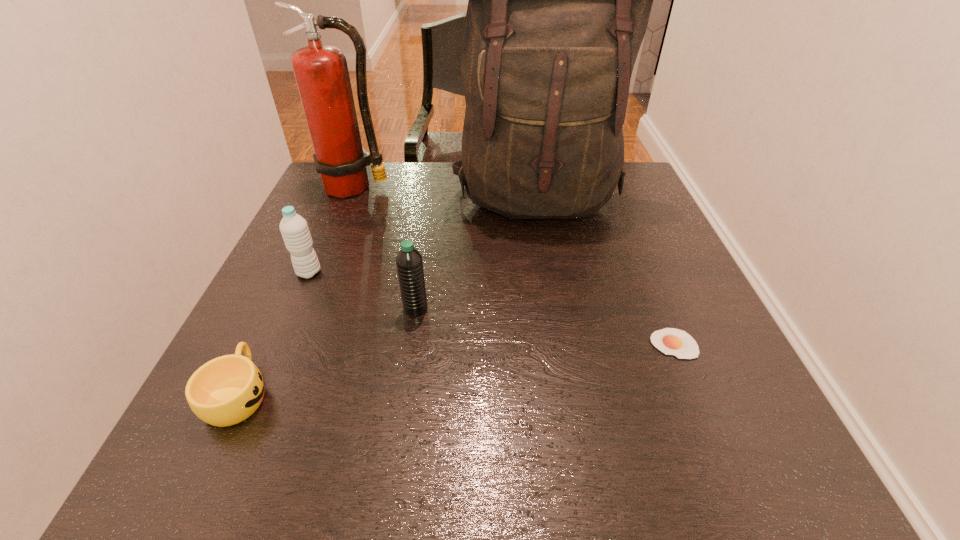
Locate an element on the screen. This screenshot has width=960, height=540. water bottle that is at the left edge is located at coordinates pos(294,229).

You are a GUI agent. You are given a task and a screenshot of the screen. Output one action in this format:
    pyautogui.click(x=<x>, y=<y>)
    Task: Click on the cup situated at the left edge
    The height and width of the screenshot is (540, 960).
    Given the screenshot: What is the action you would take?
    pyautogui.click(x=226, y=390)

What are the coordinates of `backpack at the right edge` in the screenshot? It's located at (559, 0).

The height and width of the screenshot is (540, 960). I want to click on egg yolk at the right edge, so click(670, 341).

The height and width of the screenshot is (540, 960). I want to click on object that is positioned at the far left corner, so click(321, 72).

You are a GUI agent. You are given a task and a screenshot of the screen. Output one action in this format:
    pyautogui.click(x=<x>, y=<y>)
    Task: Click on the object that is at the near left corner
    
    Given the screenshot: What is the action you would take?
    pyautogui.click(x=226, y=390)

Image resolution: width=960 pixels, height=540 pixels. In order to click on object present at the far right corner in this screenshot , I will do `click(559, 0)`.

In the image, there is a desktop. Identify the location of blank space at the far edge. click(422, 180).

In the image, there is a desktop. Identify the location of free space at the near edge. (329, 438).

At what (x,y) coordinates should I click in order to perform the action: click on free space at the left edge. Please return your answer as a coordinate pair (x, y). Image resolution: width=960 pixels, height=540 pixels. Looking at the image, I should click on (291, 327).